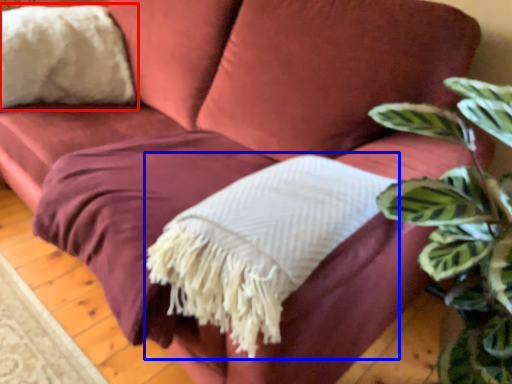
Question: Among these objects, which one is farthest to the camera, throw pillow (highlighted by a red box) or blanket (highlighted by a blue box)?

Choices:
 (A) throw pillow
 (B) blanket

Answer: (A)